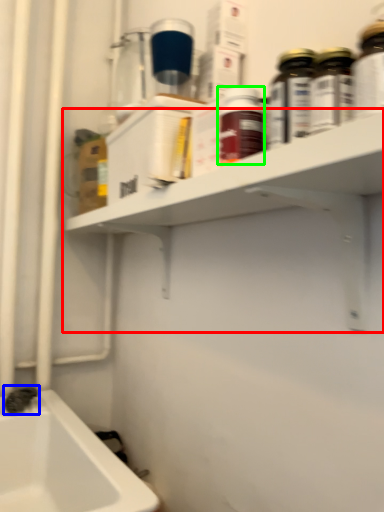
Question: Which object is positioned closest to shelf (highlighted by a red box)? Select from plumbing fixture (highlighted by a blue box) and bottle (highlighted by a green box).

Choices:
 (A) plumbing fixture
 (B) bottle

Answer: (B)